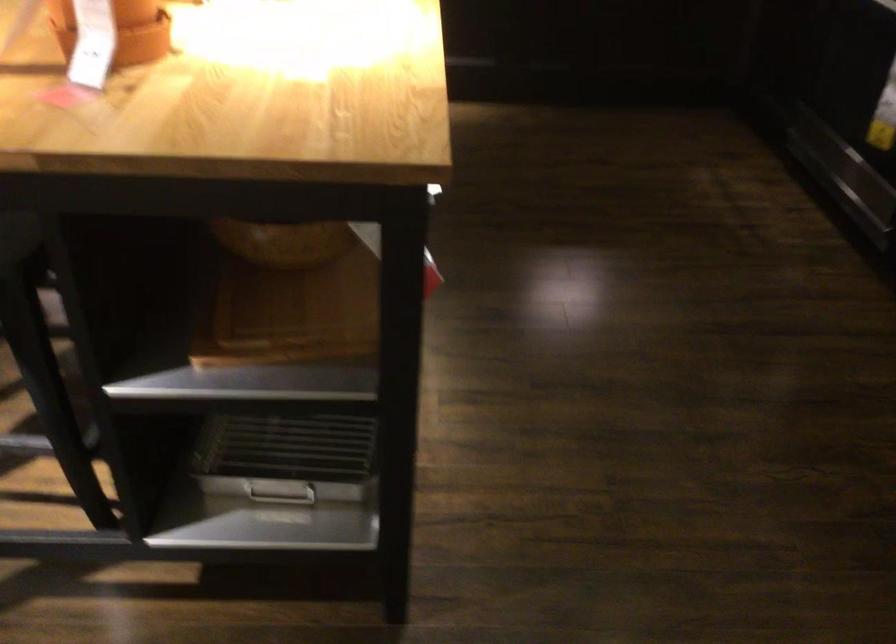
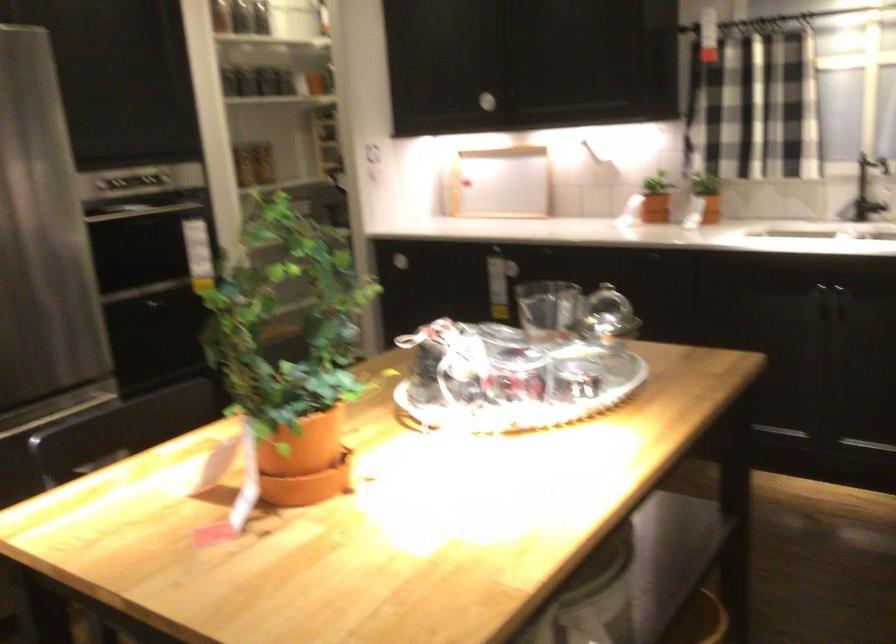
How did the camera likely rotate?

The camera's rotation is toward left-up.